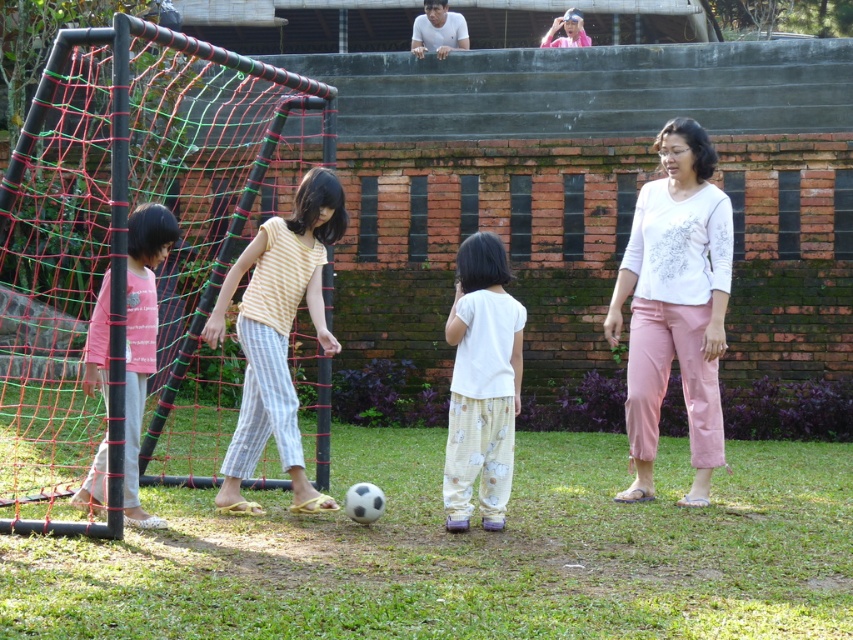
Can you confirm if white matte shirt at center is smaller than pink fabric shirt at left?

Actually, white matte shirt at center might be larger than pink fabric shirt at left.

Locate an element on the screen. The image size is (853, 640). white matte shirt at center is located at coordinates (675, 305).

Which is behind, point (508, 356) or point (558, 20)?

Point (558, 20)

Which of these two, white cotton shirt at center or pink fabric cap at upper center, stands taller?

white cotton shirt at center

Is point (479, 349) farther from viewer compared to point (573, 33)?

No, it is not.

Find the location of a particular element. white cotton shirt at center is located at coordinates (480, 384).

Can you confirm if yellow striped shirt at center is positioned above white cotton shirt at center?

Yes.

Who is positioned more to the right, yellow striped shirt at center or white cotton shirt at center?

Positioned to the right is white cotton shirt at center.

Where is `yellow striped shirt at center`? The width and height of the screenshot is (853, 640). yellow striped shirt at center is located at coordinates (277, 337).